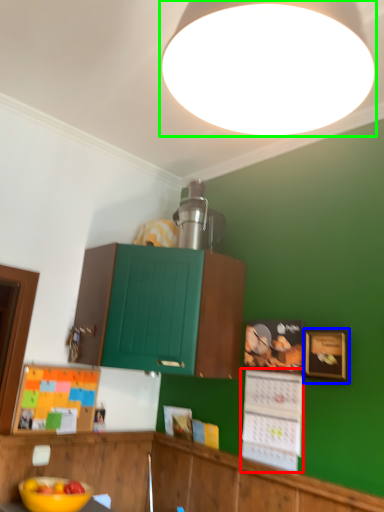
Question: Which is farther away from bulletin board (highlighted by a red box)? picture frame (highlighted by a blue box) or lamp (highlighted by a green box)?

Choices:
 (A) picture frame
 (B) lamp

Answer: (B)